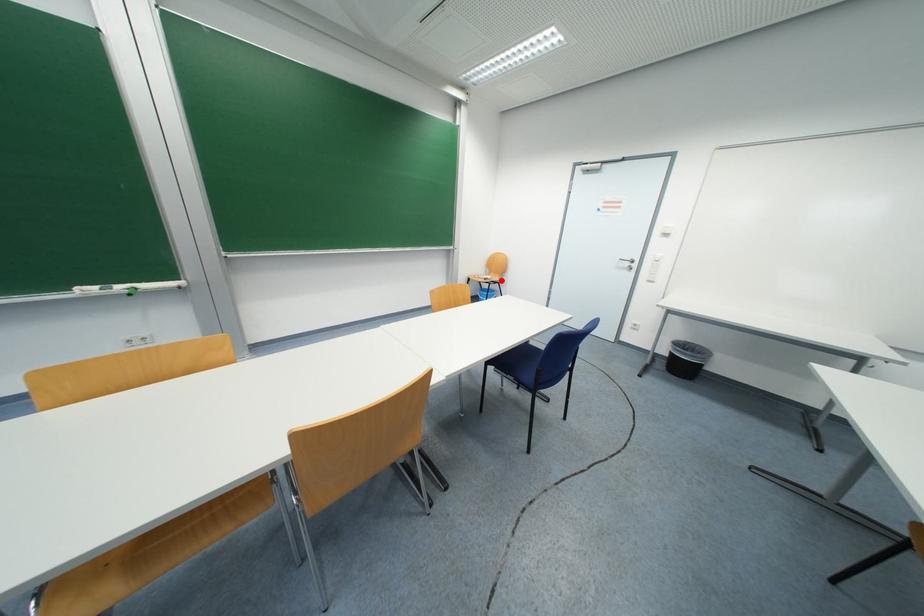
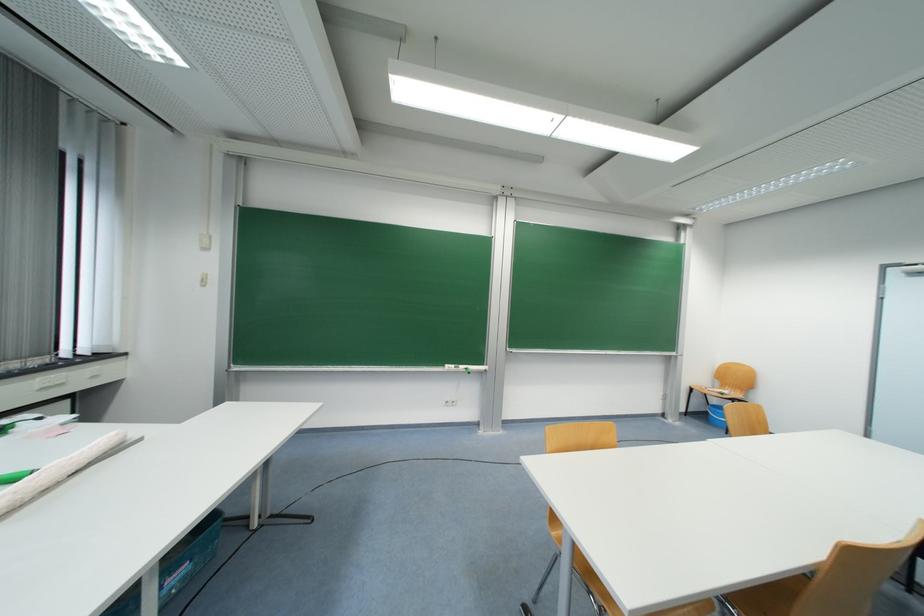
Question: I am providing you with two images of the same scene from different viewpoints. Image1 has a red point marked. In image2, the corresponding 3D location appears at what relative position? Reply with the corresponding letter.

Choices:
 (A) Closer
 (B) Farther

Answer: (B)